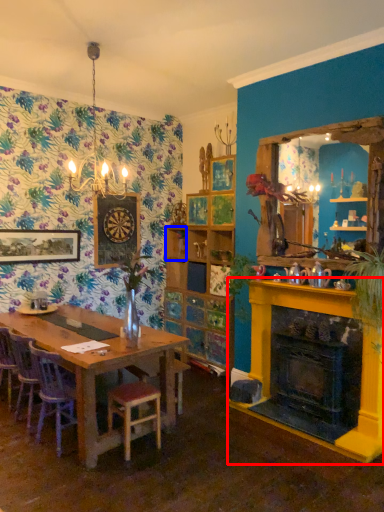
Question: Which object appears farthest to the camera in this image, fireplace (highlighted by a red box) or shelf (highlighted by a blue box)?

Choices:
 (A) fireplace
 (B) shelf

Answer: (B)